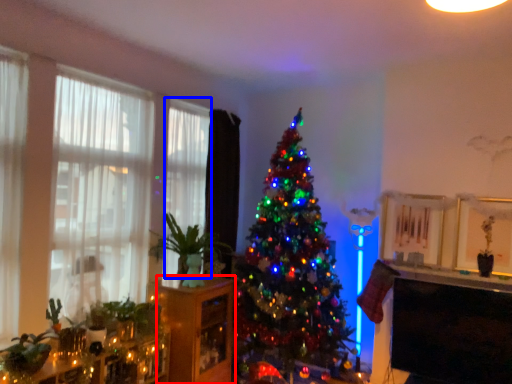
Question: Which point is further to the camera, shelf (highlighted by a red box) or curtain (highlighted by a blue box)?

Choices:
 (A) shelf
 (B) curtain

Answer: (B)